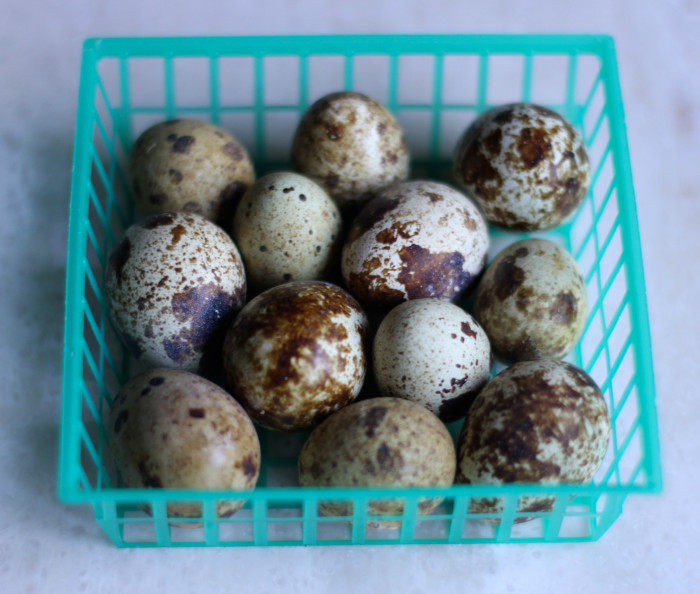
I want to click on top left corner of basket, so click(94, 53).